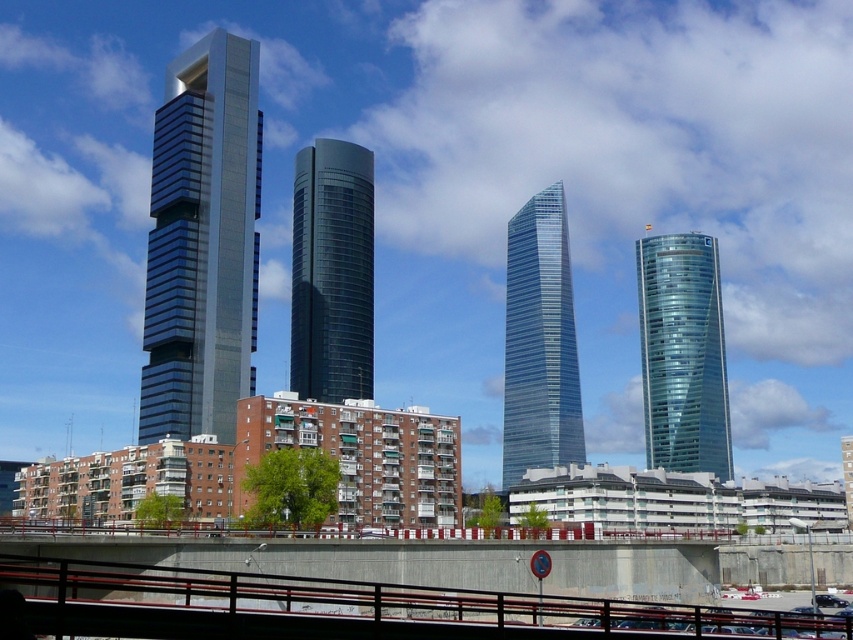
Question: Among these objects, which one is nearest to the camera?

Choices:
 (A) shiny glass tower at center
 (B) transparent glass skyscraper at center

Answer: (A)

Question: Which point is farther to the camera?

Choices:
 (A) (705, 312)
 (B) (341, 273)

Answer: (A)

Question: Does glassy steel skyscraper at center-left have a lesser width compared to shiny glass tower at center?

Choices:
 (A) yes
 (B) no

Answer: (A)

Question: Estimate the real-world distances between objects in this image. Which object is farther from the transparent glass skyscraper at center?

Choices:
 (A) concrete bridge at lower center
 (B) glassy steel skyscraper at center-left
 (C) metallic bridge at center

Answer: (C)

Question: Does metallic bridge at center have a lesser width compared to transparent glass skyscraper at center?

Choices:
 (A) no
 (B) yes

Answer: (A)

Question: Is shiny glass tower at center to the left of transparent glass tower at right from the viewer's perspective?

Choices:
 (A) yes
 (B) no

Answer: (A)